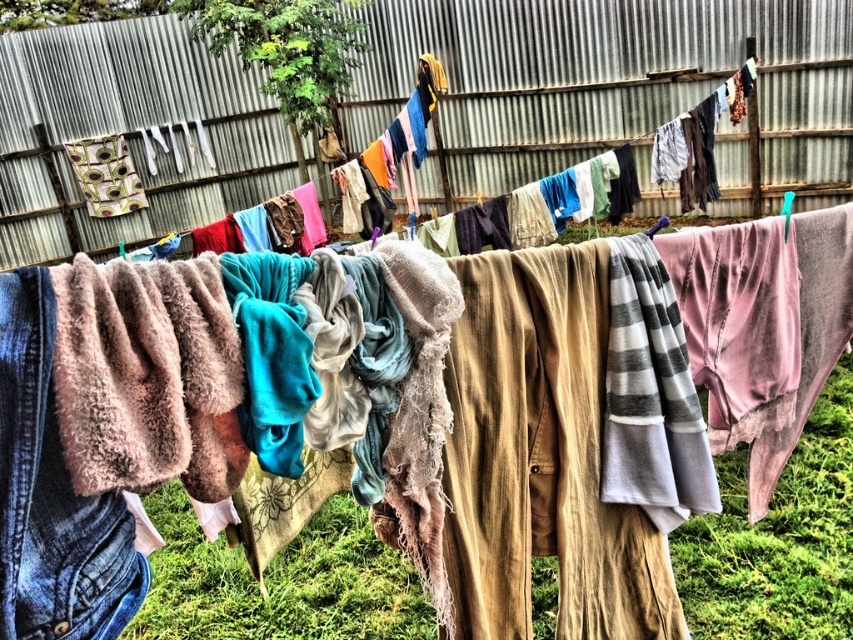
You are standing in the backyard looking at the laundry setup. Which object is taller between the metallic corrugated fence at upper center and the fuzzy beige blanket at center?

The metallic corrugated fence at upper center is taller than the fuzzy beige blanket at center.

You are trying to hang a new towel on the clothesline between the fuzzy beige blanket at center and the denim at left. Based on their widths, which side should you choose to ensure the towel has enough space?

The fuzzy beige blanket at center might be wider than the denim at left, so you should choose the side of the denim at left to hang the new towel since it is likely narrower and leaves more space.

You are a painter standing 10 feet away from the metallic corrugated fence at upper center. You want to paint the fuzzy beige blanket at center without moving closer. Can you reach it with your 12 foot long paintbrush?

The metallic corrugated fence at upper center and fuzzy beige blanket at center are 14.07 feet apart from each other. Since you are 10 feet away from the fence, the distance between you and the blanket is 14.07 feet minus your distance to the fence. Wait, actually, if you are 10 feet from the fence and the blanket is 14.07 feet from the fence, then the total distance from you to the blanket would be 10 feet plus 14.07 feet, which is 24.07 feet. Your paintbrush is only 12 feet long, so you cannot reach it.